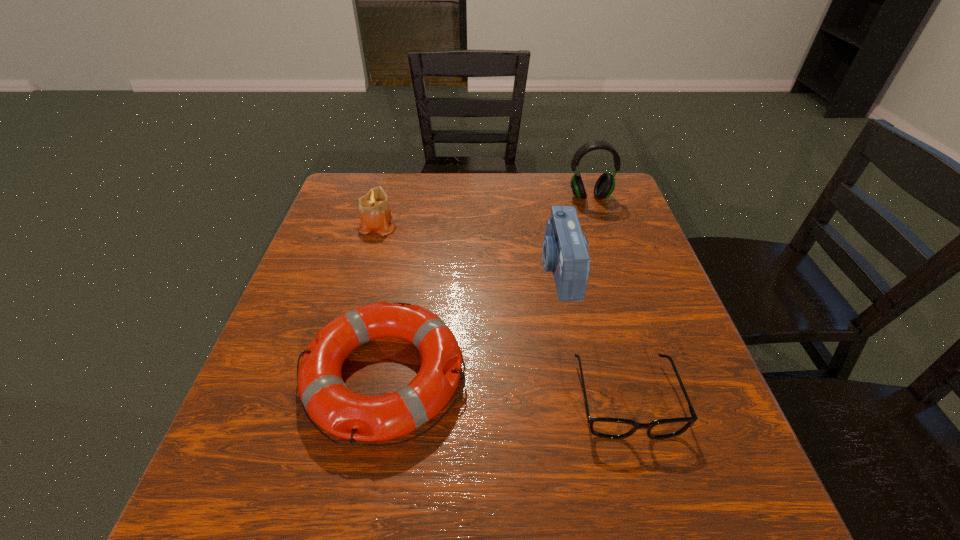
Identify the location of the farthest object. (605, 185).

Image resolution: width=960 pixels, height=540 pixels. I want to click on headset, so click(605, 185).

The width and height of the screenshot is (960, 540). Find the location of `camera`. camera is located at coordinates (565, 249).

Image resolution: width=960 pixels, height=540 pixels. I want to click on the fourth nearest object, so click(x=375, y=214).

The width and height of the screenshot is (960, 540). What are the coordinates of `the fourth tallest object` in the screenshot? It's located at (329, 403).

Where is `the shortest object`? Image resolution: width=960 pixels, height=540 pixels. the shortest object is located at coordinates (612, 428).

At what (x,y) coordinates should I click in order to perform the action: click on vacant area situated 0.090m on the ear cups of the tallest object. Please return your answer as a coordinate pair (x, y). This screenshot has width=960, height=540. Looking at the image, I should click on (598, 224).

Find the location of a particular element. The image size is (960, 540). vacant region located on the lens of the third farthest object is located at coordinates (475, 269).

Locate an element on the screen. The height and width of the screenshot is (540, 960). vacant space located on the lens of the third farthest object is located at coordinates (509, 269).

Locate an element on the screen. The height and width of the screenshot is (540, 960). free location located on the lens of the third farthest object is located at coordinates (399, 269).